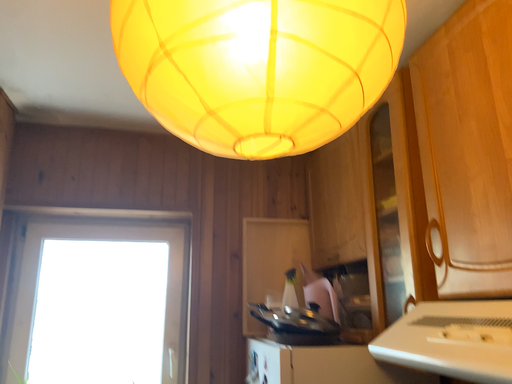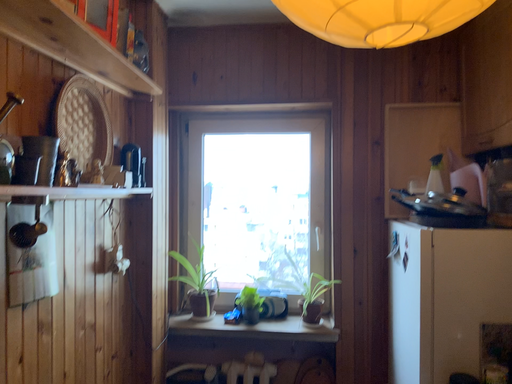
Question: How did the camera likely rotate when shooting the video?

Choices:
 (A) rotated downward
 (B) rotated upward

Answer: (A)